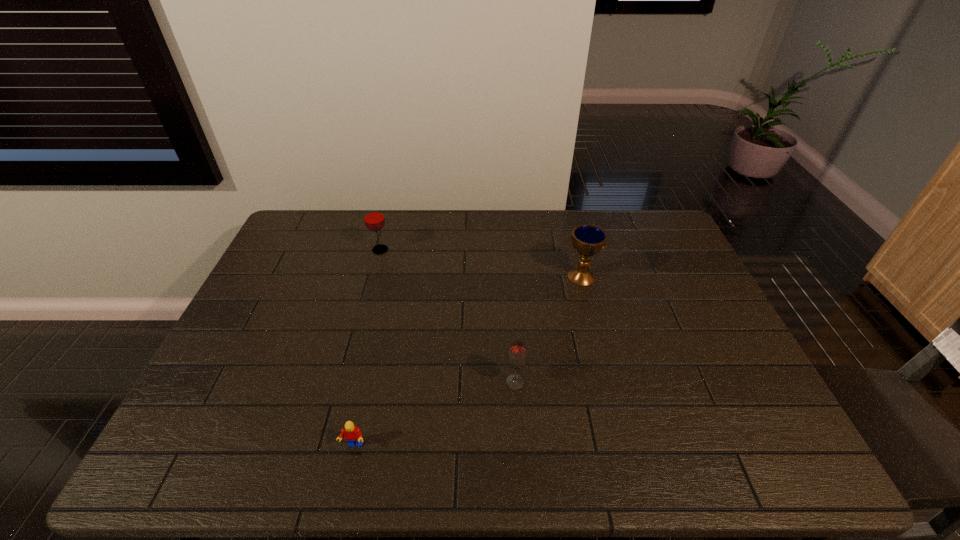
This screenshot has height=540, width=960. Find the location of `empty space between the third object from left to right and the nearest object`. empty space between the third object from left to right and the nearest object is located at coordinates (434, 414).

Locate an element on the screen. empty location between the second object from right to left and the farther glass drink container is located at coordinates (447, 316).

Locate an element on the screen. vacant space that's between the farther glass drink container and the nearer glass drink container is located at coordinates (447, 316).

Image resolution: width=960 pixels, height=540 pixels. I want to click on vacant space that is in between the shortest object and the rightmost object, so click(x=468, y=361).

What are the coordinates of `unoccupied position between the left glass drink container and the rightmost object` in the screenshot? It's located at (481, 263).

Image resolution: width=960 pixels, height=540 pixels. Identify the location of vacant space that is in between the Lego and the shorter glass drink container. (434, 414).

Locate an element on the screen. This screenshot has height=540, width=960. free point between the nearest object and the left glass drink container is located at coordinates (367, 348).

Select which object appears as the third closest to the rightmost object. Please provide its 2D coordinates. Your answer should be formatted as a tuple, i.e. [(x, y)], where the tuple contains the x and y coordinates of a point satisfying the conditions above.

[(352, 433)]

Select which object appears as the third closest to the taller glass drink container. Please provide its 2D coordinates. Your answer should be formatted as a tuple, i.e. [(x, y)], where the tuple contains the x and y coordinates of a point satisfying the conditions above.

[(352, 433)]